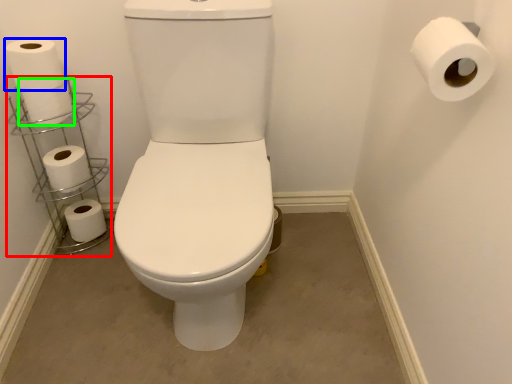
Question: Based on their relative distances, which object is nearer to shelf (highlighted by a red box)? Choose from toilet paper (highlighted by a blue box) and toilet paper (highlighted by a green box).

Choices:
 (A) toilet paper
 (B) toilet paper

Answer: (B)